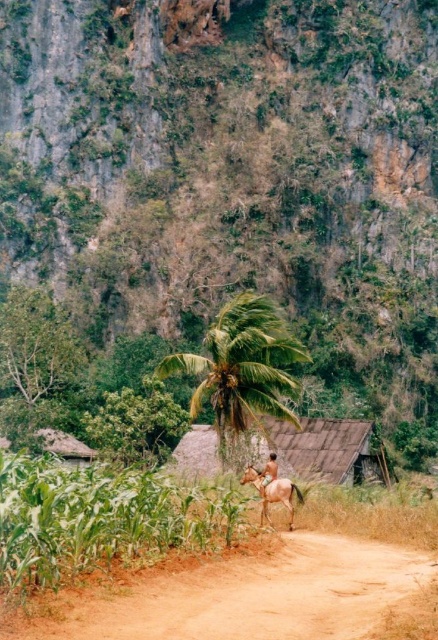
Looking at this image, how distant is brown dirt track at lower center from brown glossy horse at center?

brown dirt track at lower center and brown glossy horse at center are 7.08 meters apart.

In the scene shown: Does brown dirt track at lower center appear on the right side of brown glossy horse at center?

Indeed, brown dirt track at lower center is positioned on the right side of brown glossy horse at center.

The image size is (438, 640). I want to click on brown dirt track at lower center, so click(x=244, y=595).

Image resolution: width=438 pixels, height=640 pixels. What are the coordinates of `brown dirt track at lower center` in the screenshot? It's located at (244, 595).

Which is below, green leafy palm tree at center or brown leather horse at center?

brown leather horse at center is lower down.

The width and height of the screenshot is (438, 640). In order to click on green leafy palm tree at center in this screenshot , I will do `click(242, 365)`.

What do you see at coordinates (242, 365) in the screenshot? This screenshot has height=640, width=438. I see `green leafy palm tree at center` at bounding box center [242, 365].

This screenshot has width=438, height=640. Find the location of `green leafy palm tree at center`. green leafy palm tree at center is located at coordinates (242, 365).

Is the position of green leafy hillside at upper center more distant than that of green leafy palm tree at center?

That is True.

Between green leafy hillside at upper center and green leafy palm tree at center, which one has more height?

With more height is green leafy hillside at upper center.

The width and height of the screenshot is (438, 640). In order to click on green leafy hillside at upper center in this screenshot , I will do [x=233, y=172].

This screenshot has height=640, width=438. Find the location of `green leafy hillside at upper center`. green leafy hillside at upper center is located at coordinates (233, 172).